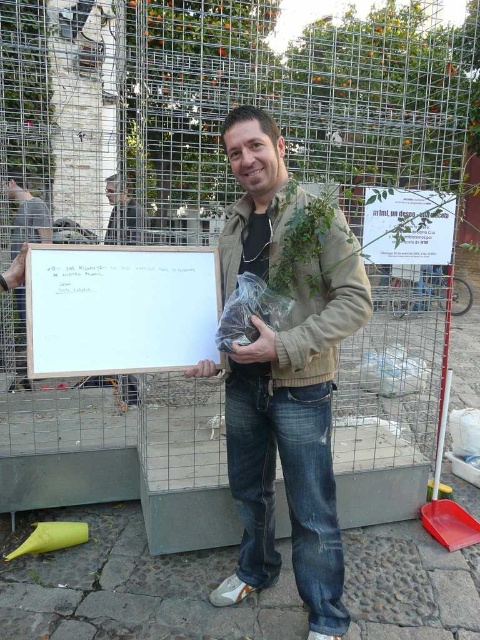
Which is behind, point (46, 236) or point (111, 211)?

Positioned behind is point (111, 211).

Where is `matte white board at center`? matte white board at center is located at coordinates (26, 214).

Is point (222, 275) positioned in front of point (183, 248)?

No, it is behind (183, 248).

Consider the image. Does brown leather jacket at center have a larger size compared to white matte board at center?

Indeed, brown leather jacket at center has a larger size compared to white matte board at center.

Between point (326, 280) and point (173, 294), which one is positioned in front?

Positioned in front is point (326, 280).

Where is `brown leather jacket at center`? Image resolution: width=480 pixels, height=640 pixels. brown leather jacket at center is located at coordinates (294, 436).

Can you confirm if white matte board at center is positioned below matte white board at center?

Yes.

Can you confirm if white matte board at center is bigger than matte white board at center?

No.

Is point (41, 300) more distant than point (14, 196)?

No.

This screenshot has width=480, height=640. Find the location of `white matte board at center`. white matte board at center is located at coordinates (120, 308).